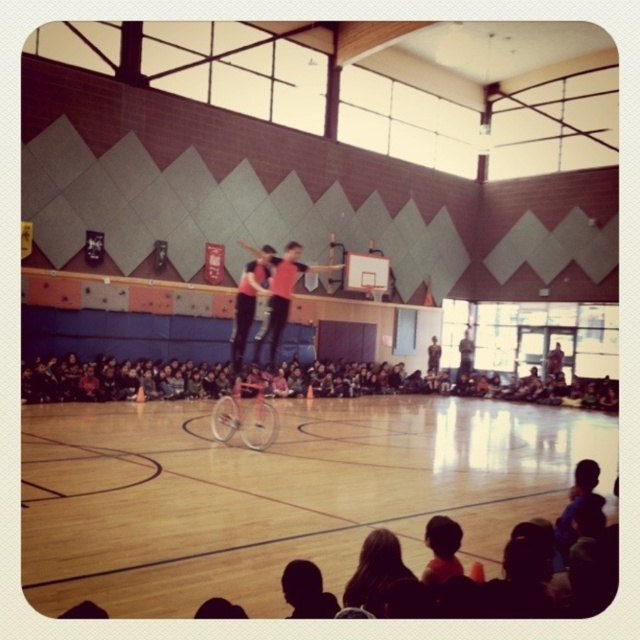
You are a photographer positioned at the back of the gymnasium. You want to capture a photo of the matte pink bicycle at center without including the wooden basketball court at center in the frame. Which direction should you move to achieve this?

Since the wooden basketball court at center is to the left of the matte pink bicycle at center, you should move to the right side to position yourself so that the court is out of the frame while keeping the bicycle in view.

You are a stagehand responsible for setting up the gymnasium. You need to ensure that the wooden basketball court at center and the matte pink bicycle at center are positioned so that the taller object is placed closer to the ceiling. Which object should be placed closer to the ceiling?

The matte pink bicycle at center should be placed closer to the ceiling since it is taller than the wooden basketball court at center.

You are a stagehand setting up for a school play in the gymnasium. You need to place a pink matte bicycle at center so that it stays on the wooden basketball court at center. Is the bicycle currently positioned correctly?

The wooden basketball court at center is below the pink matte bicycle at center, meaning the bicycle is already placed on top of the court, so it is correctly positioned.